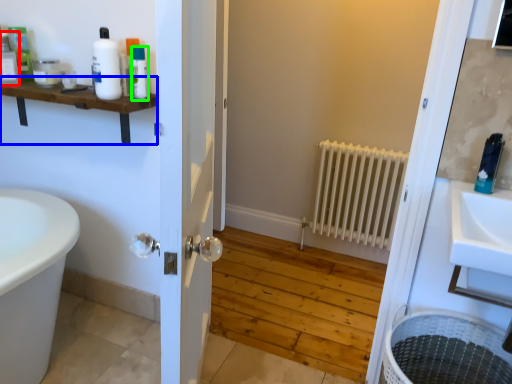
Question: Which object is the farthest from toiletry (highlighted by a red box)? Choose among these: balustrade (highlighted by a blue box) or toiletry (highlighted by a green box).

Choices:
 (A) balustrade
 (B) toiletry

Answer: (B)